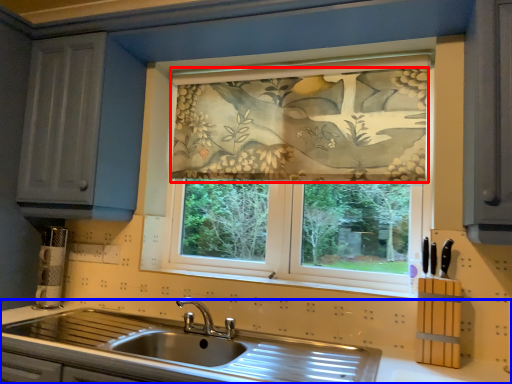
Question: Among these objects, which one is farthest to the camera, curtain (highlighted by a red box) or countertop (highlighted by a blue box)?

Choices:
 (A) curtain
 (B) countertop

Answer: (A)